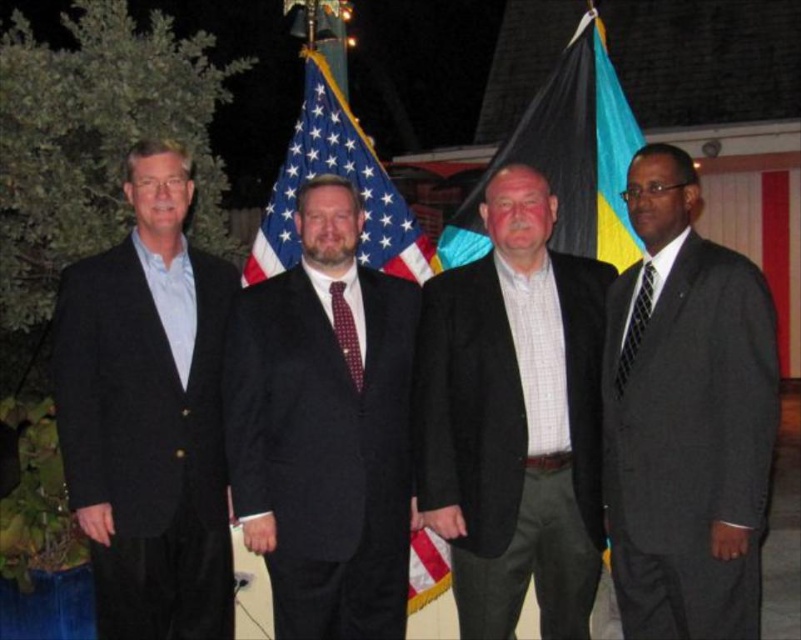
Does matte black suit at left have a greater height compared to black fabric flag at center?

Correct, matte black suit at left is much taller as black fabric flag at center.

Which is more to the left, matte black suit at left or black fabric flag at center?

matte black suit at left is more to the left.

Does point (180, 358) come behind point (461, 256)?

No, it is not.

Identify the location of matte black suit at left. The width and height of the screenshot is (801, 640). (147, 413).

Who is positioned more to the left, matte gray suit at right or black fabric flag at center?

black fabric flag at center

Which is more to the right, matte gray suit at right or black fabric flag at center?

From the viewer's perspective, matte gray suit at right appears more on the right side.

This screenshot has width=801, height=640. I want to click on matte gray suit at right, so click(x=686, y=417).

Does checkered fabric shirt at center have a greater height compared to matte gray suit at right?

No.

Is checkered fabric shirt at center bigger than matte gray suit at right?

Actually, checkered fabric shirt at center might be smaller than matte gray suit at right.

What are the coordinates of `checkered fabric shirt at center` in the screenshot? It's located at (514, 419).